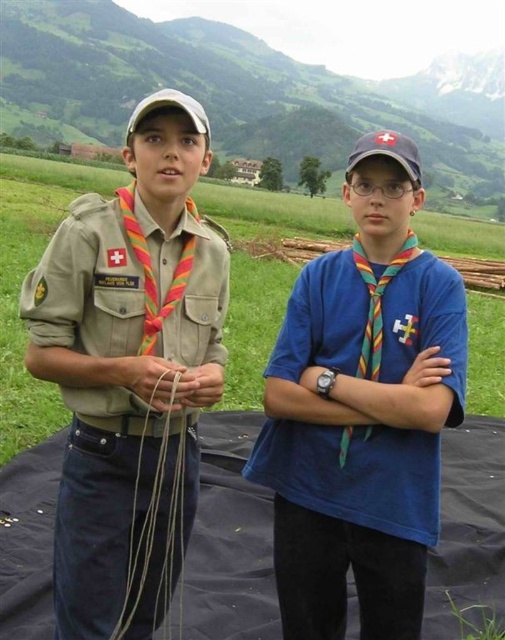
Based on the photo, you are a photographer trying to capture a group photo of the scouts. Since the tan uniform at left is above the blue matte shirt at center, which scout should you focus on to ensure both are in frame?

You should focus on the tan uniform at left because it is positioned above the blue matte shirt at center, so adjusting the camera to include the upper area where the tan uniform at left is located will also capture the blue matte shirt at center below.